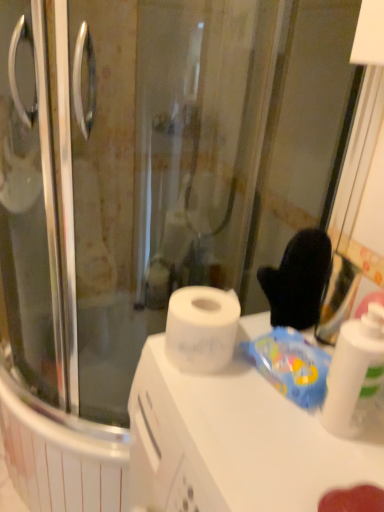
The width and height of the screenshot is (384, 512). I want to click on free space to the left of blue plastic bag at upper right, so click(x=213, y=388).